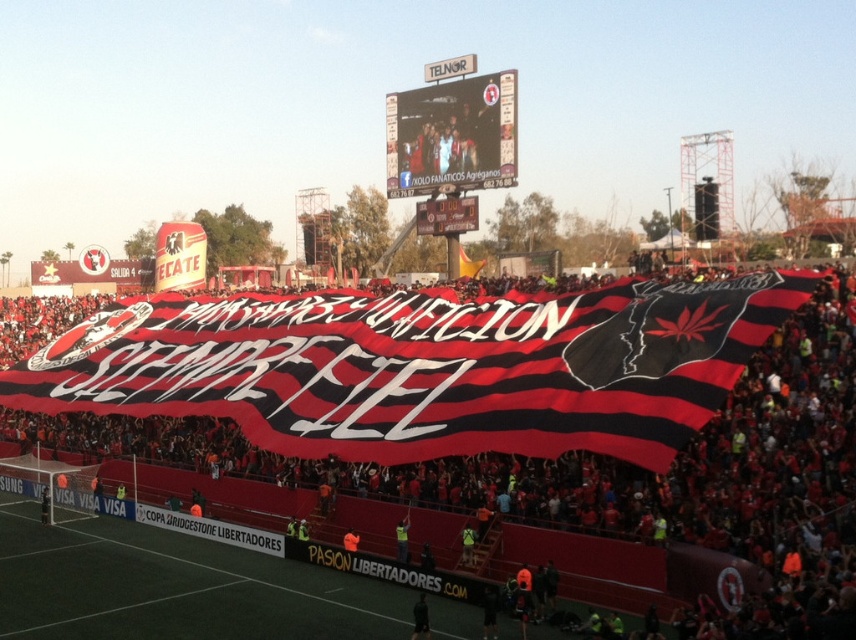
You are standing in the soccer stadium and want to determine which of the two points, point (569, 394) or point (421, 168), is closer to you. Based on the scene description, which point is nearer?

Point (569, 394) is closer to the viewer than point (421, 168).

You are a photographer standing at the edge of the soccer stadium field. You want to take a photo of the black and red striped banner at center that is held by the crowd. The minimum focus distance of your camera is 150 feet. Can you focus on the banner from your current position?

The black and red striped banner at center is 175.74 feet from viewer. Since the minimum focus distance of your camera is 150 feet, you can focus on the banner because it is beyond the minimum required distance.

You are a photographer at the soccer stadium and want to capture both the black and red striped banner at center and the matte plastic scoreboard at upper center in a single shot. Which object should you focus on first to ensure both are in frame?

The black and red striped banner at center is shorter than the matte plastic scoreboard at upper center, so you should focus on the matte plastic scoreboard at upper center first to ensure both objects are captured in the frame.